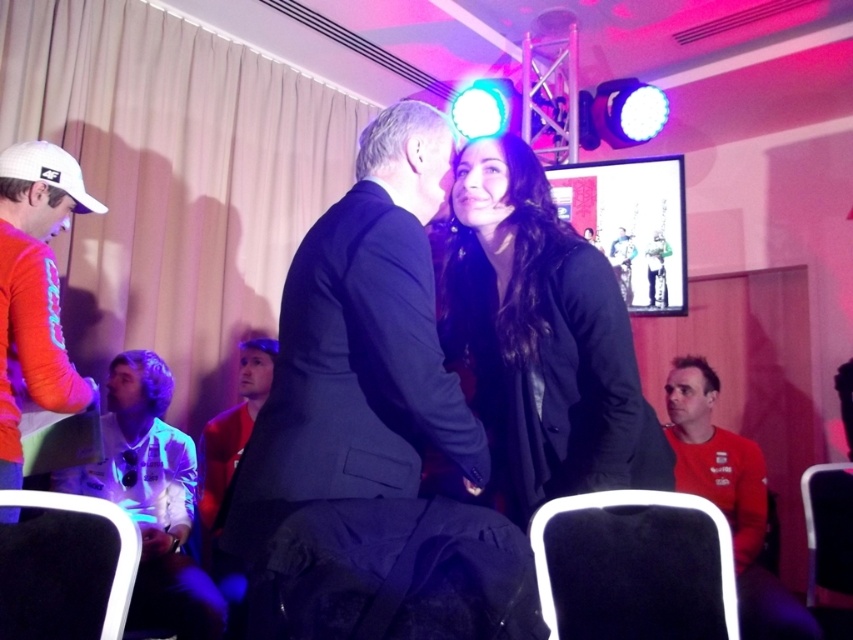
You are standing in the event hall and see two points marked in the image. Which point is closer to you, point (491, 385) or point (10, 486)?

Point (491, 385) is further to the viewer than point (10, 486), so the closer point to you is point (10, 486).

You are attending this event and want to take a photo of both the white glossy shirt at lower left and the red matte shirt at lower right. Which shirt should you focus on first if you want to capture both in the same frame without moving the camera?

The white glossy shirt at lower left is taller than the red matte shirt at lower right, so you should focus on the white glossy shirt at lower left first to ensure both are in frame.

Please look at the scene and locate the point at coordinates (372, 429). What object is located at that point?

The point at coordinates (372, 429) corresponds to the dark gray suit at center.